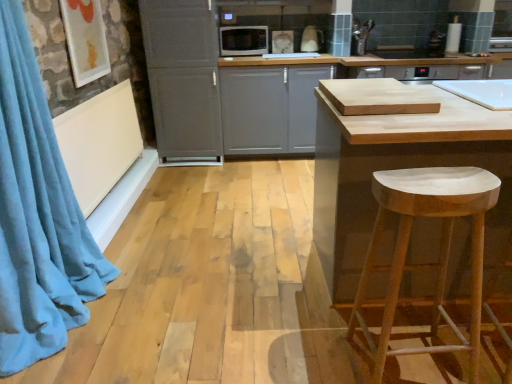
I want to click on blank space to the left of white matte stool at lower right, so click(x=309, y=349).